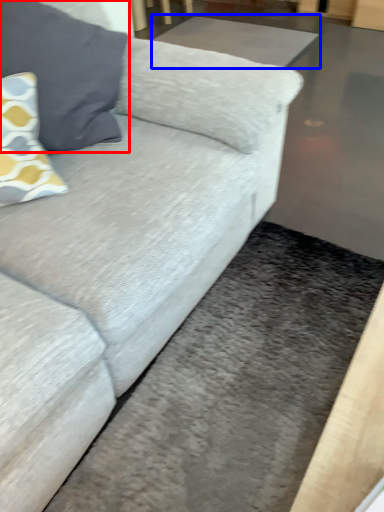
Question: Which point is further to the camera, pillow (highlighted by a red box) or flat (highlighted by a blue box)?

Choices:
 (A) pillow
 (B) flat

Answer: (B)